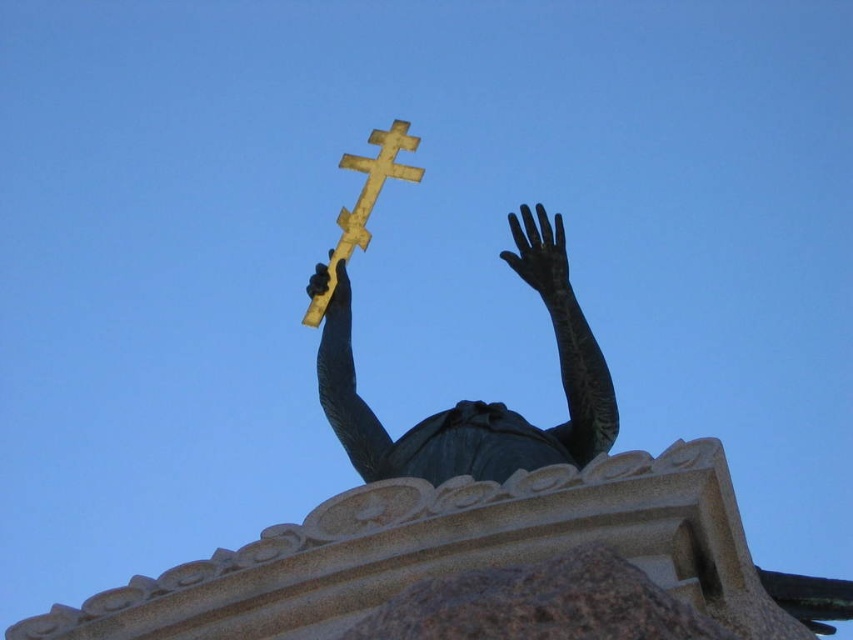
You are an art student analyzing the statue and cross in the image. Based on their sizes, which object would require more material to create? Please refer to the bronze statue at center and the gold polished wood cross at upper center in your analysis.

The bronze statue at center is larger in size than the gold polished wood cross at upper center, so it would require more material to create.

You are an art conservator assessing the statue. You need to determine if the black matte hand at upper center is part of the bronze statue at center. Based on the description, can you confirm if the hand is part of the statue?

The bronze statue at center has a larger size compared to black matte hand at upper center, which indicates that the hand is part of the statue as it is proportionally smaller and positioned at the upper center of the statue.